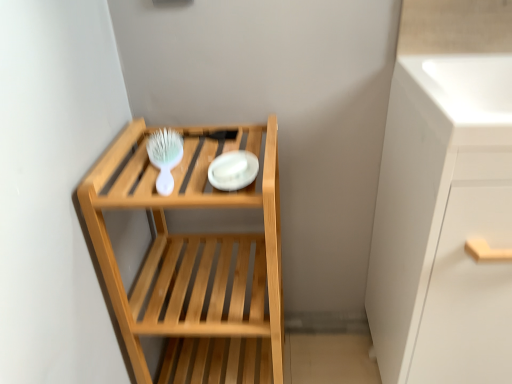
Identify the location of vacant area that lies to the right of white plastic brush at upper left. (236, 167).